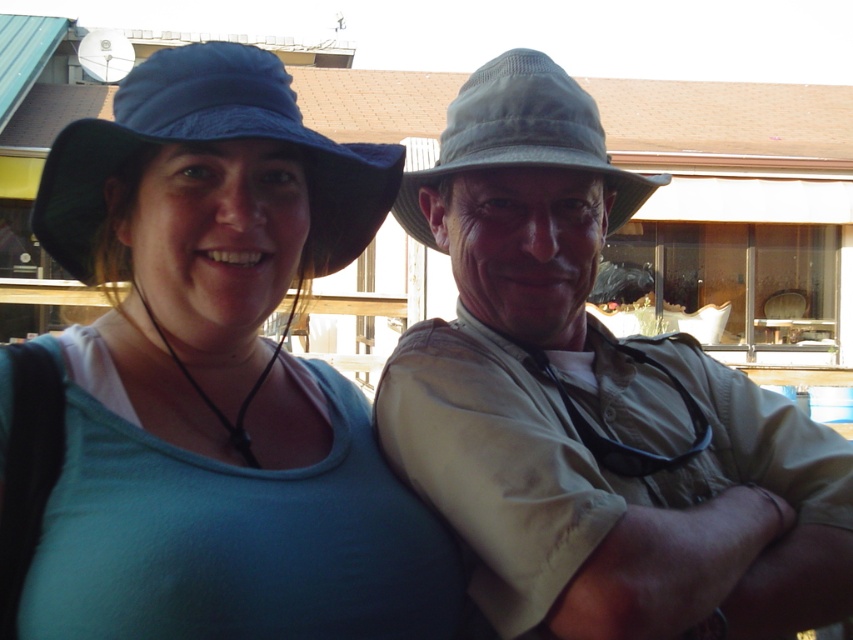
Question: Where is blue fabric cowboy hat at left located in relation to gray fabric cowboy hat at upper center in the image?

Choices:
 (A) above
 (B) below

Answer: (B)

Question: Based on their relative distances, which object is nearer to the gray fabric cowboy hat at upper center?

Choices:
 (A) khaki fabric shirt at center
 (B) matte blue hat at upper left

Answer: (A)

Question: Which of the following is the farthest from the observer?

Choices:
 (A) (619, 170)
 (B) (782, 474)
 (C) (125, 556)
 (D) (357, 224)

Answer: (D)

Question: Does matte blue hat at upper left appear over blue fabric cowboy hat at left?

Choices:
 (A) no
 (B) yes

Answer: (A)

Question: Can you confirm if matte blue hat at upper left is thinner than gray fabric cowboy hat at upper center?

Choices:
 (A) no
 (B) yes

Answer: (A)

Question: Which of these objects is positioned farthest from the gray fabric cowboy hat at upper center?

Choices:
 (A) matte blue hat at upper left
 (B) blue fabric cowboy hat at left

Answer: (A)